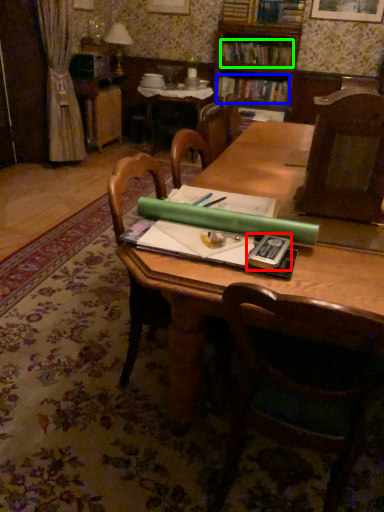
Question: Which is nearer to the paperback book (highlighted by a red box)? book (highlighted by a blue box) or book (highlighted by a green box).

Choices:
 (A) book
 (B) book

Answer: (A)